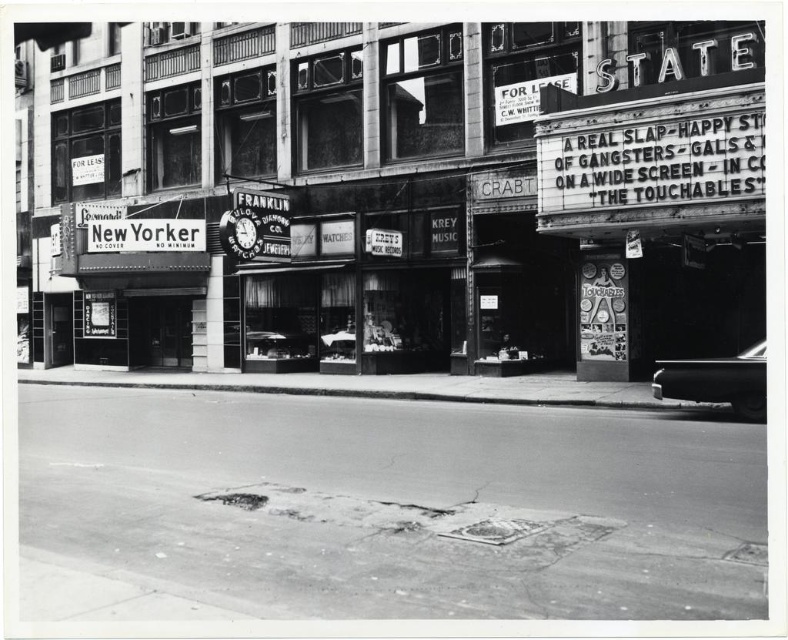
Does neon sign theater at upper right have a lesser width compared to shiny black car at right?

No, neon sign theater at upper right is not thinner than shiny black car at right.

Does neon sign theater at upper right appear on the left side of shiny black car at right?

Indeed, neon sign theater at upper right is positioned on the left side of shiny black car at right.

Where is `neon sign theater at upper right`? neon sign theater at upper right is located at coordinates (419, 188).